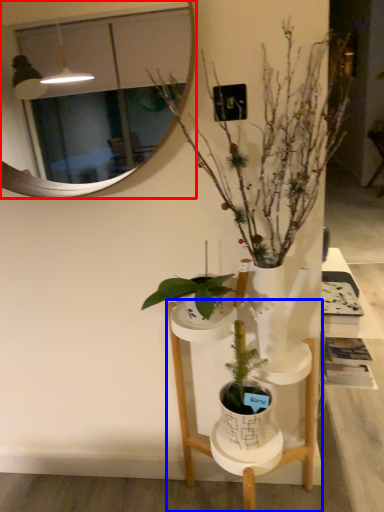
Question: Which object appears farthest to the camera in this image, mirror (highlighted by a red box) or furniture (highlighted by a blue box)?

Choices:
 (A) mirror
 (B) furniture

Answer: (A)